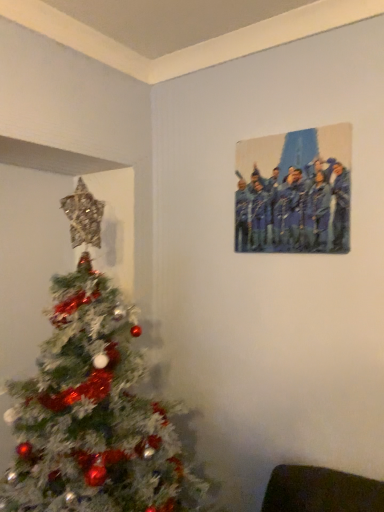
This screenshot has width=384, height=512. What are the coordinates of `shiny metallic christmas tree at left` in the screenshot? It's located at (93, 404).

Describe the element at coordinates (93, 404) in the screenshot. I see `shiny metallic christmas tree at left` at that location.

Measure the distance between shiny metallic christmas tree at left and camera.

They are 3.43 feet apart.

What is the approximate width of metallic blue painting at upper right?

metallic blue painting at upper right is 6.06 inches wide.

Where is `metallic blue painting at upper right`? The image size is (384, 512). metallic blue painting at upper right is located at coordinates (294, 191).

What do you see at coordinates (294, 191) in the screenshot? This screenshot has width=384, height=512. I see `metallic blue painting at upper right` at bounding box center [294, 191].

Find the location of a particular element. shiny metallic christmas tree at left is located at coordinates (93, 404).

Considering the positions of objects metallic blue painting at upper right and shiny metallic christmas tree at left in the image provided, who is more to the right, metallic blue painting at upper right or shiny metallic christmas tree at left?

metallic blue painting at upper right.

Considering the relative positions of metallic blue painting at upper right and shiny metallic christmas tree at left in the image provided, is metallic blue painting at upper right behind shiny metallic christmas tree at left?

Yes, metallic blue painting at upper right is behind shiny metallic christmas tree at left.

Considering the points (251, 198) and (24, 436), which point is behind, point (251, 198) or point (24, 436)?

The point (251, 198) is farther from the camera.

From the image's perspective, who appears lower, metallic blue painting at upper right or shiny metallic christmas tree at left?

shiny metallic christmas tree at left.

From a real-world perspective, is metallic blue painting at upper right physically located above or below shiny metallic christmas tree at left?

Clearly, from a real-world perspective, metallic blue painting at upper right is above shiny metallic christmas tree at left.

Is metallic blue painting at upper right wider or thinner than shiny metallic christmas tree at left?

metallic blue painting at upper right is thinner than shiny metallic christmas tree at left.

Is metallic blue painting at upper right taller or shorter than shiny metallic christmas tree at left?

In the image, metallic blue painting at upper right appears to be shorter than shiny metallic christmas tree at left.

Who is smaller, metallic blue painting at upper right or shiny metallic christmas tree at left?

metallic blue painting at upper right is smaller.

Is metallic blue painting at upper right inside or outside of shiny metallic christmas tree at left?

metallic blue painting at upper right is spatially situated outside shiny metallic christmas tree at left.

Is metallic blue painting at upper right next to shiny metallic christmas tree at left and touching it?

metallic blue painting at upper right is not next to shiny metallic christmas tree at left, and they're not touching.

Is metallic blue painting at upper right turned away from shiny metallic christmas tree at left?

That's not correct — metallic blue painting at upper right is not looking away from shiny metallic christmas tree at left.

I want to click on picture frame on the right of shiny metallic christmas tree at left, so click(x=294, y=191).

Which is more to the left, shiny metallic christmas tree at left or metallic blue painting at upper right?

shiny metallic christmas tree at left.

Which object is closer to the camera, shiny metallic christmas tree at left or metallic blue painting at upper right?

Positioned in front is shiny metallic christmas tree at left.

Which is farther, (48, 461) or (316, 174)?

Positioned behind is point (316, 174).

From the image's perspective, is shiny metallic christmas tree at left on metallic blue painting at upper right?

No, from the image's perspective, shiny metallic christmas tree at left is not on top of metallic blue painting at upper right.

From a real-world perspective, relative to metallic blue painting at upper right, is shiny metallic christmas tree at left vertically above or below?

Clearly, from a real-world perspective, shiny metallic christmas tree at left is below metallic blue painting at upper right.

Considering the sizes of objects shiny metallic christmas tree at left and metallic blue painting at upper right in the image provided, who is wider, shiny metallic christmas tree at left or metallic blue painting at upper right?

Wider between the two is shiny metallic christmas tree at left.

Can you confirm if shiny metallic christmas tree at left is taller than metallic blue painting at upper right?

Correct, shiny metallic christmas tree at left is much taller as metallic blue painting at upper right.

Is shiny metallic christmas tree at left smaller than metallic blue painting at upper right?

Incorrect, shiny metallic christmas tree at left is not smaller in size than metallic blue painting at upper right.

Could metallic blue painting at upper right be considered to be inside shiny metallic christmas tree at left?

Actually, metallic blue painting at upper right is outside shiny metallic christmas tree at left.

Are shiny metallic christmas tree at left and metallic blue painting at upper right beside each other?

No, shiny metallic christmas tree at left is not with metallic blue painting at upper right.

Does shiny metallic christmas tree at left turn towards metallic blue painting at upper right?

No, shiny metallic christmas tree at left is not oriented towards metallic blue painting at upper right.

The image size is (384, 512). Identify the location of picture frame lying above the shiny metallic christmas tree at left (from the image's perspective). (294, 191).

This screenshot has height=512, width=384. Identify the location of christmas tree that is in front of the metallic blue painting at upper right. (93, 404).

Locate an element on the screen. christmas tree below the metallic blue painting at upper right (from the image's perspective) is located at coordinates (93, 404).